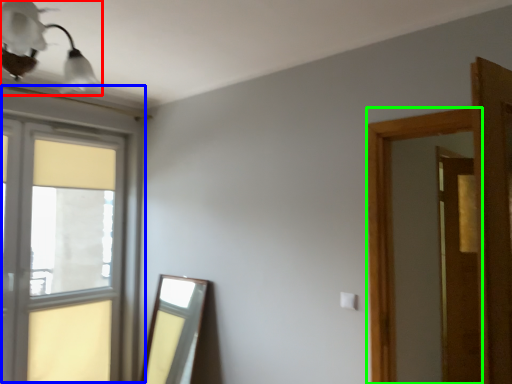
Question: Which object is the farthest from light fixture (highlighted by a red box)? Choose among these: window (highlighted by a blue box) or window frame (highlighted by a green box).

Choices:
 (A) window
 (B) window frame

Answer: (B)